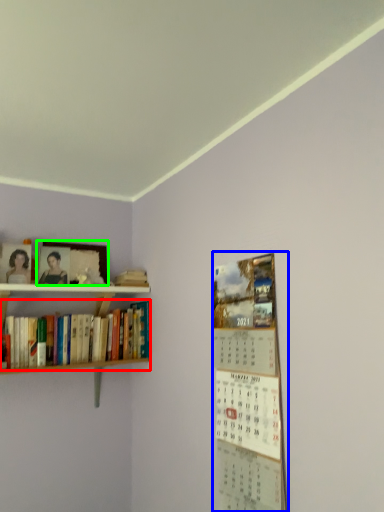
Question: Considering the real-world distances, which object is closest to book (highlighted by a red box)? bulletin board (highlighted by a blue box) or picture frame (highlighted by a green box).

Choices:
 (A) bulletin board
 (B) picture frame

Answer: (B)